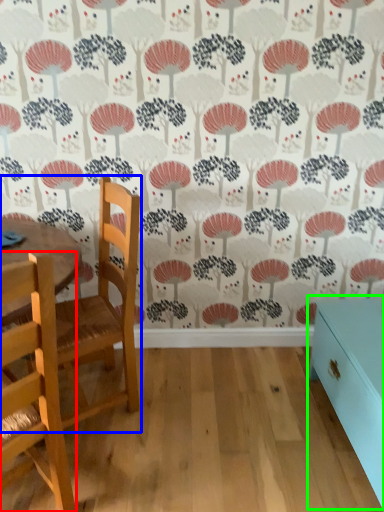
Question: Considering the real-world distances, which object is farthest from chair (highlighted by a red box)? chair (highlighted by a blue box) or table (highlighted by a green box)?

Choices:
 (A) chair
 (B) table

Answer: (B)